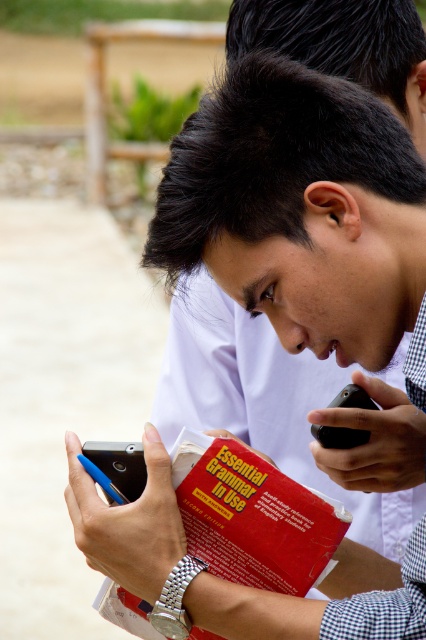
You are a photographer trying to capture a photo of the red matte book at center and the blue glossy smartphone at lower left. To ensure both are in frame, you need to know their relative positions. Which object is positioned to the right of the other?

The red matte book at center is to the right of the blue glossy smartphone at lower left, so the red matte book at center is positioned to the right of the blue glossy smartphone at lower left.

You are trying to read the red matte book at center but the blue glossy smartphone at lower left is blocking your view. Can you move the book to the side to see the smartphone better?

The red matte book at center is in front of the blue glossy smartphone at lower left, so moving the book to the side would allow you to see the smartphone better.

You are a delivery robot that is 0.5 meters wide. You are standing in the scene and want to move from your current position to the door located to the right of the book. Can you pass between the blue glossy smartphone at lower left and the book?

The blue glossy smartphone at lower left and viewer are 1.27 meters apart. Since the distance between the blue glossy smartphone at lower left and the book is not specified, it is impossible to determine if the robot can pass through.